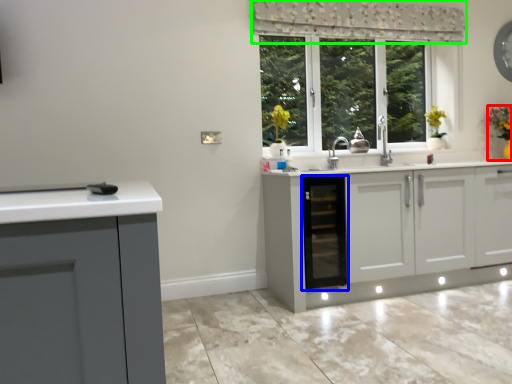
Question: Considering the real-world distances, which object is farthest from houseplant (highlighted by a red box)? dish washer (highlighted by a blue box) or curtain (highlighted by a green box)?

Choices:
 (A) dish washer
 (B) curtain

Answer: (A)